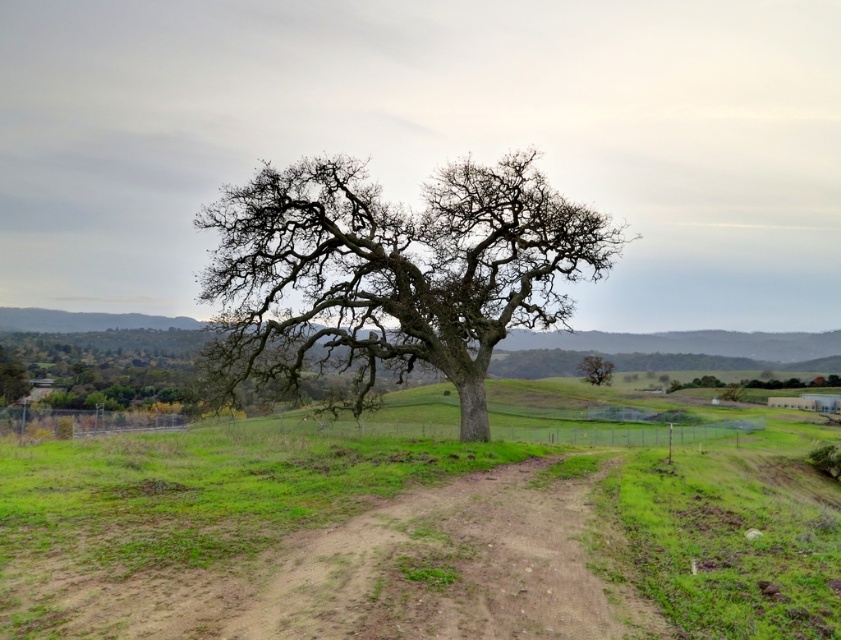
You are standing at the point with coordinates point [500,248] and want to walk to the point with coordinates point [73,508]. Given the terrain described in the scene, is the path between these two points likely to be obstructed by the large tree?

Point [73,508] is in front of point [500,248], so the path between them is likely unobstructed by the large tree since the destination point is closer to the viewer and the tree is in the foreground.

In the scene shown: You are a hiker trying to navigate through the rural landscape shown. You see the brown dirt track at center and the smooth bark oak at center. Which object is taller?

The smooth bark oak at center is taller than the brown dirt track at center according to the description.